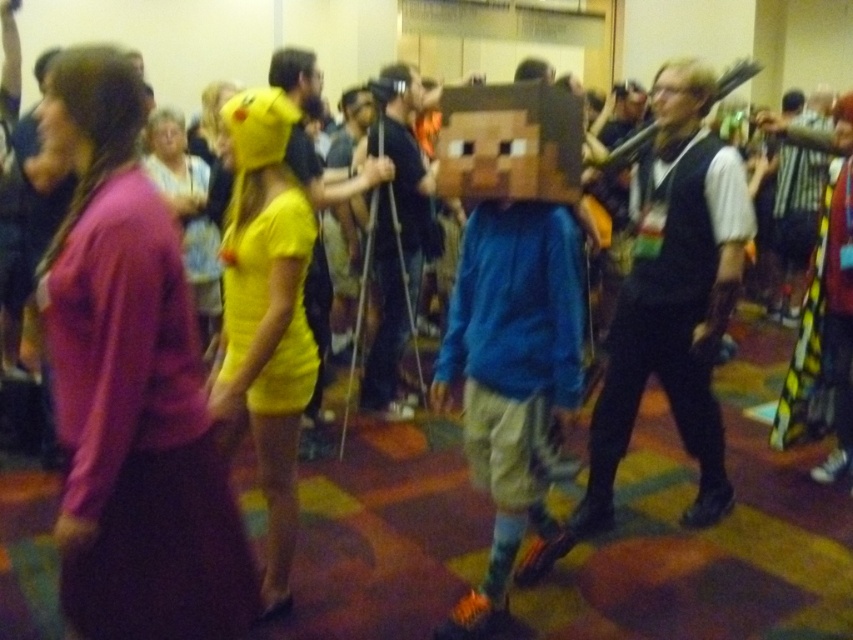
You are a photographer at the event and need to position the matte black vest at center and the wooden block at center so that they are exactly 3 feet apart. Based on their current positions, do you need to move them closer together or farther apart?

The matte black vest at center is currently 33.90 inches from the wooden block at center. Since 3 feet equals 36 inches, the objects are closer than required. Therefore, you need to move them farther apart to reach the desired distance.

You are a photographer at the event and need to capture both the matte black vest at center and the wooden block at center in a single shot. Which object should you focus on first to ensure both are in focus?

You should focus on the matte black vest at center first since it is closer to the viewer than the wooden block at center, ensuring both will be in focus when using a proper depth of field.